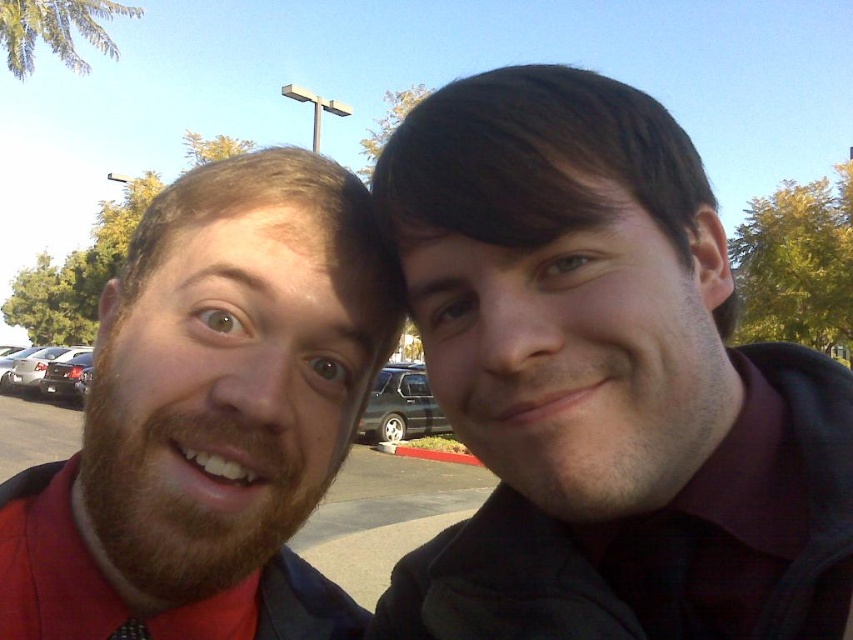
Question: Can you confirm if shiny black suv at center is bigger than silver metallic sedan at left?

Choices:
 (A) yes
 (B) no

Answer: (A)

Question: Which point is closer to the camera?

Choices:
 (A) shiny black car at left
 (B) shiny black suv at center
 (C) bearded man at left

Answer: (C)

Question: Which of the following is the farthest from the observer?

Choices:
 (A) (138, 637)
 (B) (410, 129)
 (C) (64, 401)
 (D) (67, 355)

Answer: (C)

Question: Is silver metallic sedan at left below black satin tie at lower left?

Choices:
 (A) yes
 (B) no

Answer: (A)

Question: Does shiny black car at left have a larger size compared to black satin tie at lower left?

Choices:
 (A) yes
 (B) no

Answer: (A)

Question: Among these points, which one is farthest from the camera?

Choices:
 (A) (373, 404)
 (B) (30, 388)

Answer: (B)